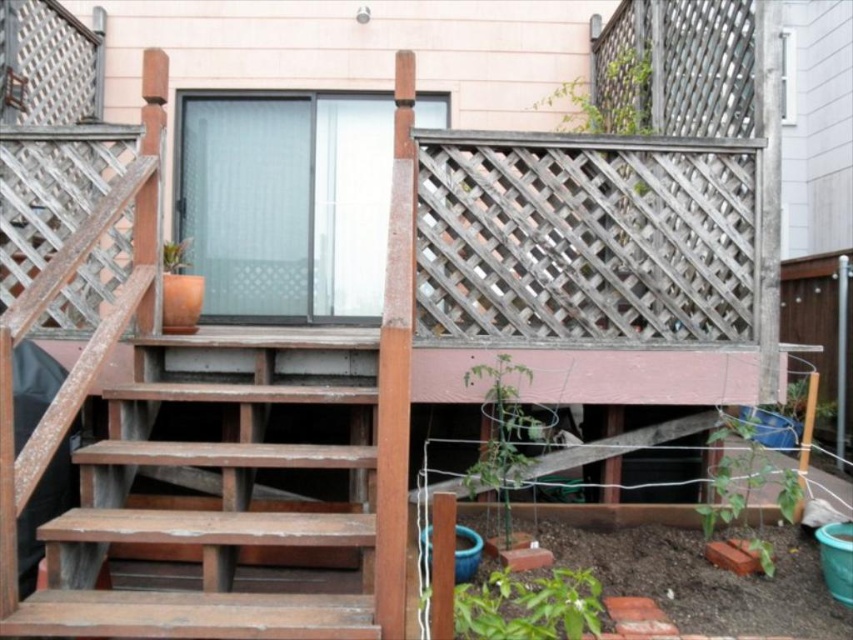
You are a gardener planning to move the green leafy plant at lower right and the green matte plant at center to a new location. Based on their sizes, which plant requires a larger container to accommodate its width?

The green leafy plant at lower right might require a larger container since it might be wider than the green matte plant at center.

Looking at this image, you are a gardener who needs to water both the green leafy plant at lower center and the green matte plant at center. If your watering can has a maximum reach of 24 inches, can you water both plants without moving the can? Please explain your reasoning.

The green leafy plant at lower center is 24.70 inches away from the green matte plant at center. Since the distance between them exceeds the watering can reach of 24 inches, you cannot water both plants without moving the can.

You are standing on the wooden deck and want to place a new potted plant between the green leafy plant at lower right and the green matte plant at center. Is there enough space between them to fit a standard 12 inch wide pot?

The green leafy plant at lower right is to the right of the green matte plant at center, but the exact distance between them isn not provided. Without knowing the spacing, it is impossible to determine if a 12 inch pot would fit.